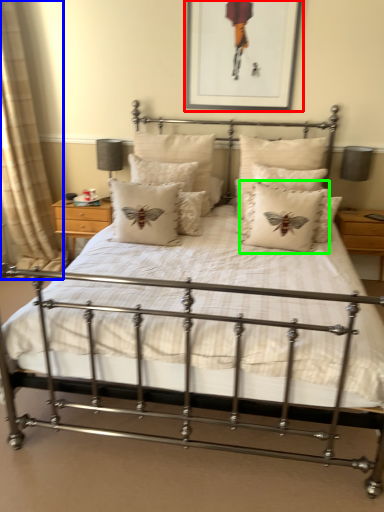
Question: Which object is positioned closest to picture frame (highlighted by a red box)? Select from curtain (highlighted by a blue box) and pillow (highlighted by a green box).

Choices:
 (A) curtain
 (B) pillow

Answer: (B)